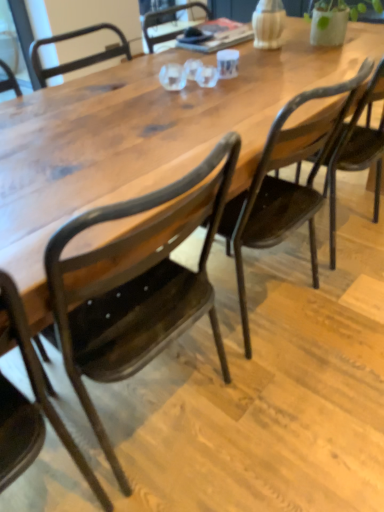
Question: Is matte black chair at center, which is the second chair from right to left, beside metallic dark brown chair at lower left, which appears as the 3th chair when viewed from the right?

Choices:
 (A) no
 (B) yes

Answer: (A)

Question: Does matte black chair at center, which is the second chair from right to left, lie in front of metallic dark brown chair at lower left, which is the 1th chair in left-to-right order?

Choices:
 (A) no
 (B) yes

Answer: (A)

Question: Is matte black chair at center, which is the second chair from right to left, taller than metallic dark brown chair at lower left, which appears as the 3th chair when viewed from the right?

Choices:
 (A) no
 (B) yes

Answer: (A)

Question: Does matte black chair at center, which appears as the second chair when viewed from the left, have a greater width compared to metallic dark brown chair at lower left, which is the 1th chair in left-to-right order?

Choices:
 (A) yes
 (B) no

Answer: (B)

Question: Considering the relative sizes of matte black chair at center, which is the second chair from right to left, and metallic dark brown chair at lower left, which is the 1th chair in left-to-right order, in the image provided, is matte black chair at center, which is the second chair from right to left, thinner than metallic dark brown chair at lower left, which is the 1th chair in left-to-right order,?

Choices:
 (A) no
 (B) yes

Answer: (B)

Question: Would you say metallic dark brown chair at lower left, which appears as the 3th chair when viewed from the right, is to the left or to the right of matte black chair at center, which appears as the second chair when viewed from the left, in the picture?

Choices:
 (A) left
 (B) right

Answer: (A)

Question: Does point (46, 399) appear closer or farther from the camera than point (148, 285)?

Choices:
 (A) farther
 (B) closer

Answer: (B)

Question: From a real-world perspective, is metallic dark brown chair at lower left, which is the 1th chair in left-to-right order, positioned above or below matte black chair at center, which is the second chair from right to left?

Choices:
 (A) above
 (B) below

Answer: (B)

Question: Considering their positions, is metallic dark brown chair at lower left, which appears as the 3th chair when viewed from the right, located in front of or behind matte black chair at center, which appears as the second chair when viewed from the left?

Choices:
 (A) front
 (B) behind

Answer: (A)

Question: In the image, is matte black chair at center, which appears as the second chair when viewed from the left, positioned in front of or behind metallic dark brown chair at lower left, which is the 1th chair in left-to-right order?

Choices:
 (A) behind
 (B) front

Answer: (A)

Question: Is matte black chair at center, which appears as the second chair when viewed from the left, inside the boundaries of metallic dark brown chair at lower left, which appears as the 3th chair when viewed from the right, or outside?

Choices:
 (A) inside
 (B) outside

Answer: (B)

Question: Looking at their shapes, would you say matte black chair at center, which appears as the second chair when viewed from the left, is wider or thinner than metallic dark brown chair at lower left, which appears as the 3th chair when viewed from the right?

Choices:
 (A) wide
 (B) thin

Answer: (B)

Question: Is matte black chair at center, which appears as the second chair when viewed from the left, to the left or to the right of metallic dark brown chair at lower left, which is the 1th chair in left-to-right order, in the image?

Choices:
 (A) left
 (B) right

Answer: (B)

Question: From the image's perspective, relative to matte black chair at center, which is the second chair from right to left, is matte dark wood chair at center, which appears as the 1th chair when viewed from the right, above or below?

Choices:
 (A) below
 (B) above

Answer: (B)

Question: Considering the positions of matte dark wood chair at center, which appears as the 1th chair when viewed from the right, and matte black chair at center, which appears as the second chair when viewed from the left, in the image, is matte dark wood chair at center, which appears as the 1th chair when viewed from the right, taller or shorter than matte black chair at center, which appears as the second chair when viewed from the left,?

Choices:
 (A) tall
 (B) short

Answer: (B)